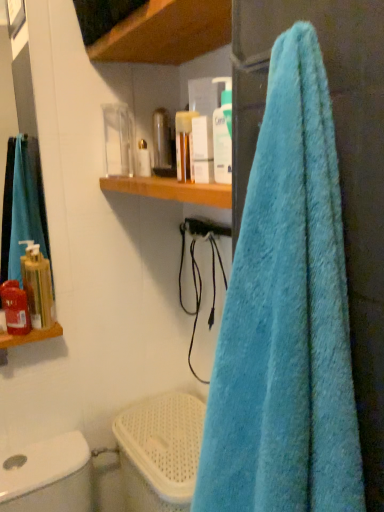
Describe the element at coordinates (15, 308) in the screenshot. The width and height of the screenshot is (384, 512). I see `matte red soap dispenser at left, which is counted as the third toiletry, starting from the back` at that location.

Identify the location of white plastic toilet bowl at lower left. (160, 451).

What do you see at coordinates (160, 451) in the screenshot? I see `white plastic toilet bowl at lower left` at bounding box center [160, 451].

What are the coordinates of `gold metallic soap dispenser at left, which is the 3th toiletry from front to back` in the screenshot? It's located at (37, 286).

Image resolution: width=384 pixels, height=512 pixels. I want to click on blue fluffy towel at right, so click(x=286, y=317).

How much space does translucent plastic bottle at upper center, the first toiletry positioned from the front, occupy horizontally?

translucent plastic bottle at upper center, the first toiletry positioned from the front, is 2.47 inches in width.

The height and width of the screenshot is (512, 384). What do you see at coordinates (143, 159) in the screenshot?
I see `matte white container at upper center, placed as the 1th toiletry when sorted from top to bottom` at bounding box center [143, 159].

In order to face matte white container at upper center, which is the third toiletry from left to right, should I rotate leftwards or rightwards?

Turn left approximately 6.141 degrees to face it.

The image size is (384, 512). What are the coordinates of `matte red soap dispenser at left, placed as the 1th toiletry when sorted from left to right` in the screenshot? It's located at (15, 308).

Is point (43, 283) farther from viewer compared to point (308, 340)?

That is True.

Is gold metallic soap dispenser at left, which appears as the 3th toiletry when viewed from the right, spatially inside blue fluffy towel at right, or outside of it?

gold metallic soap dispenser at left, which appears as the 3th toiletry when viewed from the right, exists outside the volume of blue fluffy towel at right.

Is gold metallic soap dispenser at left, which is the 3th toiletry from front to back, turned away from blue fluffy towel at right?

No, gold metallic soap dispenser at left, which is the 3th toiletry from front to back, is not facing away from blue fluffy towel at right.

Is white plastic toilet bowl at lower left surrounding translucent plastic bottle at upper center, the first toiletry positioned from the right?

Definitely not — translucent plastic bottle at upper center, the first toiletry positioned from the right, is not inside white plastic toilet bowl at lower left.

Is white plastic toilet bowl at lower left thinner than translucent plastic bottle at upper center, the first toiletry positioned from the front?

No, white plastic toilet bowl at lower left is not thinner than translucent plastic bottle at upper center, the first toiletry positioned from the front.

The image size is (384, 512). What are the coordinates of `the 4th toiletry positioned above the white plastic toilet bowl at lower left (from a real-world perspective)` in the screenshot? It's located at (184, 144).

Is white plastic toilet bowl at lower left positioned before translucent plastic bottle at upper center, which ranks as the 2th toiletry in top-to-bottom order?

No, white plastic toilet bowl at lower left is further to the viewer.

Is gold metallic soap dispenser at left, placed as the second toiletry when sorted from back to front, behind white plastic toilet bowl at lower left?

Yes, the depth of gold metallic soap dispenser at left, placed as the second toiletry when sorted from back to front, is greater than that of white plastic toilet bowl at lower left.

Looking at their sizes, would you say gold metallic soap dispenser at left, which is the 2th toiletry from left to right, is wider or thinner than white plastic toilet bowl at lower left?

gold metallic soap dispenser at left, which is the 2th toiletry from left to right, is thinner than white plastic toilet bowl at lower left.

Is gold metallic soap dispenser at left, which ranks as the third toiletry in top-to-bottom order, bigger or smaller than white plastic toilet bowl at lower left?

A: Considering their sizes, gold metallic soap dispenser at left, which ranks as the third toiletry in top-to-bottom order, takes up less space than white plastic toilet bowl at lower left.

Is white plastic toilet bowl at lower left facing towards matte red soap dispenser at left, which is the 2th toiletry from front to back?

No, white plastic toilet bowl at lower left is not oriented towards matte red soap dispenser at left, which is the 2th toiletry from front to back.

In the scene shown: Are white plastic toilet bowl at lower left and matte red soap dispenser at left, which is the 2th toiletry from front to back, beside each other?

No, white plastic toilet bowl at lower left is not making contact with matte red soap dispenser at left, which is the 2th toiletry from front to back.

Would you say white plastic toilet bowl at lower left is to the left or to the right of matte red soap dispenser at left, which is the 2th toiletry from front to back, in the picture?

In the image, white plastic toilet bowl at lower left appears on the right side of matte red soap dispenser at left, which is the 2th toiletry from front to back.

Looking at their sizes, would you say white plastic toilet bowl at lower left is wider or thinner than matte red soap dispenser at left, which is the 2th toiletry from front to back?

white plastic toilet bowl at lower left is wider than matte red soap dispenser at left, which is the 2th toiletry from front to back.

Could you tell me if blue fluffy towel at right is turned towards translucent plastic bottle at upper center, the first toiletry positioned from the front?

No, blue fluffy towel at right is not oriented towards translucent plastic bottle at upper center, the first toiletry positioned from the front.

From a real-world perspective, which is physically above, blue fluffy towel at right or translucent plastic bottle at upper center, which ranks as the fourth toiletry in left-to-right order?

In real-world perspective, translucent plastic bottle at upper center, which ranks as the fourth toiletry in left-to-right order, is above.

Would you say blue fluffy towel at right is to the left or to the right of translucent plastic bottle at upper center, which ranks as the fourth toiletry in left-to-right order, in the picture?

blue fluffy towel at right is to the right of translucent plastic bottle at upper center, which ranks as the fourth toiletry in left-to-right order.

How different are the orientations of blue fluffy towel at right and matte red soap dispenser at left, the 1th toiletry in the bottom-to-top sequence, in degrees?

The angle between the facing direction of blue fluffy towel at right and the facing direction of matte red soap dispenser at left, the 1th toiletry in the bottom-to-top sequence, is 88.8 degrees.

From a real-world perspective, who is located higher, blue fluffy towel at right or matte red soap dispenser at left, arranged as the fourth toiletry when viewed from the top?

In real-world perspective, blue fluffy towel at right is above.

Between point (312, 156) and point (5, 282), which one is positioned in front?

The point (312, 156) is closer to the camera.

Is blue fluffy towel at right aimed at matte red soap dispenser at left, the 4th toiletry from the right?

No.

Consider the image. Is matte red soap dispenser at left, the 1th toiletry in the bottom-to-top sequence, wider or thinner than wooden shelf at upper center?

Considering their sizes, matte red soap dispenser at left, the 1th toiletry in the bottom-to-top sequence, looks slimmer than wooden shelf at upper center.

What's the angular difference between matte red soap dispenser at left, the 1th toiletry in the bottom-to-top sequence, and wooden shelf at upper center's facing directions?

88.4 degrees separate the facing orientations of matte red soap dispenser at left, the 1th toiletry in the bottom-to-top sequence, and wooden shelf at upper center.

Is matte red soap dispenser at left, arranged as the fourth toiletry when viewed from the top, facing towards wooden shelf at upper center?

No.

Which object is more forward, matte red soap dispenser at left, placed as the 1th toiletry when sorted from left to right, or wooden shelf at upper center?

Positioned in front is wooden shelf at upper center.

Which toiletry is the 3rd one when counting from the left side of the blue fluffy towel at right? Please provide its 2D coordinates.

[(37, 286)]

This screenshot has width=384, height=512. Find the location of `toilet bowl below the translucent plastic bottle at upper center, the first toiletry positioned from the front (from the image's perspective)`. toilet bowl below the translucent plastic bottle at upper center, the first toiletry positioned from the front (from the image's perspective) is located at coordinates (160, 451).

Based on their spatial positions, is translucent plastic bottle at upper center, the first toiletry positioned from the right, or blue fluffy towel at right further from wooden shelf at upper center?

Based on the image, blue fluffy towel at right appears to be further to wooden shelf at upper center.

Looking at the image, which one is located closer to white plastic toilet bowl at lower left, gold metallic soap dispenser at left, which is the 3th toiletry from front to back, or matte white container at upper center, acting as the first toiletry starting from the back?

gold metallic soap dispenser at left, which is the 3th toiletry from front to back, is closer to white plastic toilet bowl at lower left.

Looking at the image, which one is located closer to wooden shelf at upper center, matte red soap dispenser at left, which is the 2th toiletry from front to back, or translucent plastic bottle at upper center, the 3th toiletry from the bottom?

The object closer to wooden shelf at upper center is translucent plastic bottle at upper center, the 3th toiletry from the bottom.

Based on their spatial positions, is white plastic toilet bowl at lower left or gold metallic soap dispenser at left, which ranks as the third toiletry in top-to-bottom order, further from matte red soap dispenser at left, placed as the 1th toiletry when sorted from left to right?

white plastic toilet bowl at lower left.

Looking at this image, which object lies nearer to the anchor point blue fluffy towel at right, wooden shelf at upper center or white plastic toilet bowl at lower left?

wooden shelf at upper center is positioned closer to the anchor blue fluffy towel at right.

Which object lies further to the anchor point matte white container at upper center, acting as the 4th toiletry starting from the front, gold metallic soap dispenser at left, placed as the second toiletry when sorted from back to front, or blue fluffy towel at right?

blue fluffy towel at right is further to matte white container at upper center, acting as the 4th toiletry starting from the front.

When comparing their distances from matte white container at upper center, which is the third toiletry from left to right, does wooden shelf at upper center or gold metallic soap dispenser at left, which is the 2th toiletry from left to right, seem closer?

Among the two, wooden shelf at upper center is located nearer to matte white container at upper center, which is the third toiletry from left to right.

Estimate the real-world distances between objects in this image. Which object is closer to translucent plastic bottle at upper center, positioned as the fourth toiletry in back-to-front order, matte white container at upper center, acting as the first toiletry starting from the back, or matte red soap dispenser at left, the 1th toiletry in the bottom-to-top sequence?

matte white container at upper center, acting as the first toiletry starting from the back, is positioned closer to the anchor translucent plastic bottle at upper center, positioned as the fourth toiletry in back-to-front order.

What are the coordinates of `shelf positioned between blue fluffy towel at right and matte red soap dispenser at left, which is counted as the third toiletry, starting from the back, from near to far` in the screenshot? It's located at (166, 33).

You are a GUI agent. You are given a task and a screenshot of the screen. Output one action in this format:
    pyautogui.click(x=<x>, y=<y>)
    Task: Click on the toilet bowl between blue fluffy towel at right and matte red soap dispenser at left, the 1th toiletry in the bottom-to-top sequence, in the front-back direction
    The height and width of the screenshot is (512, 384).
    Given the screenshot: What is the action you would take?
    [x=160, y=451]

I want to click on towel between matte white container at upper center, acting as the 4th toiletry starting from the front, and white plastic toilet bowl at lower left in the up-down direction, so click(286, 317).

Find the location of `toiletry situated between gold metallic soap dispenser at left, which ranks as the third toiletry in top-to-bottom order, and translucent plastic bottle at upper center, the 3th toiletry from the bottom, from left to right`. toiletry situated between gold metallic soap dispenser at left, which ranks as the third toiletry in top-to-bottom order, and translucent plastic bottle at upper center, the 3th toiletry from the bottom, from left to right is located at coordinates (143, 159).